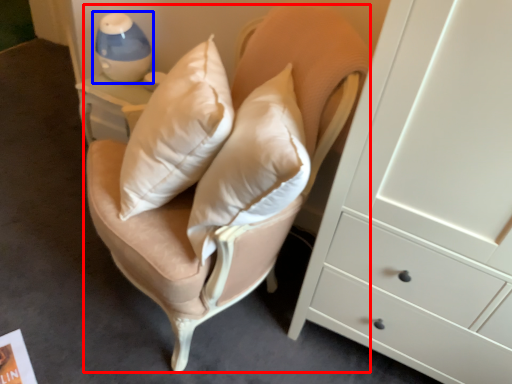
Question: Which object appears closest to the camera in this image, swivel chair (highlighted by a red box) or table lamp (highlighted by a blue box)?

Choices:
 (A) swivel chair
 (B) table lamp

Answer: (A)